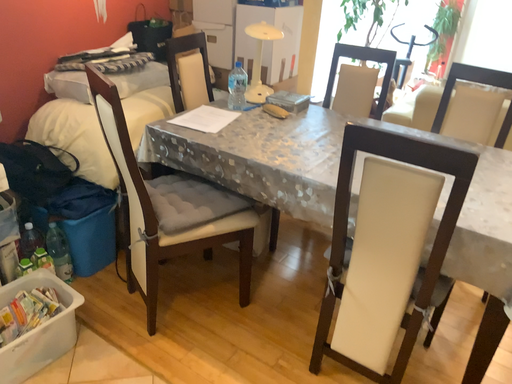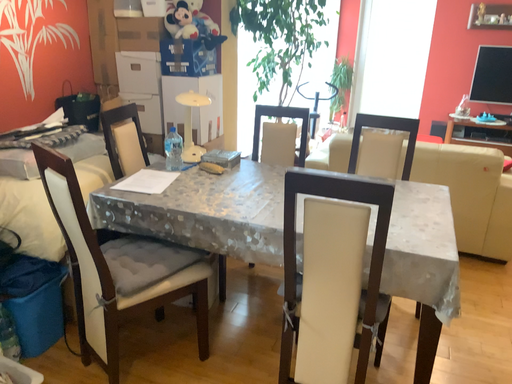
Question: Which way did the camera rotate in the video?

Choices:
 (A) rotated left
 (B) rotated right

Answer: (B)